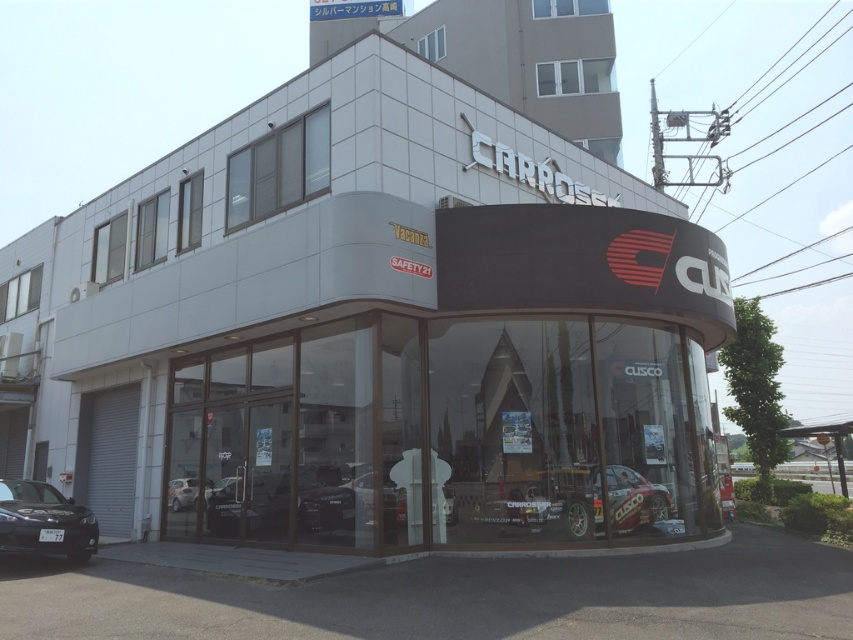
You are standing in front of the CARROSE building and want to take a photo that includes both the point at coordinates point (39, 496) and point (393, 516). Which point should you focus on to ensure both are in focus?

You should focus on point (39, 496) because it is closer to the camera than point (393, 516), ensuring both points are within the depth of field.

You are standing in front of the CARROSE building and want to take a photo of the shiny silver car at center without including the white matte building at center in the frame. Which direction should you move to achieve this?

Move to the left side of the shiny silver car at center so that the white matte building at center is no longer in the frame.

You are standing in front of the CARROSE building and want to walk towards the two points marked in the image. Which point, point (373, 538) or point (189, 486), will you reach first?

Point (373, 538) is closer to the viewer than point (189, 486), so you will reach point (373, 538) first.